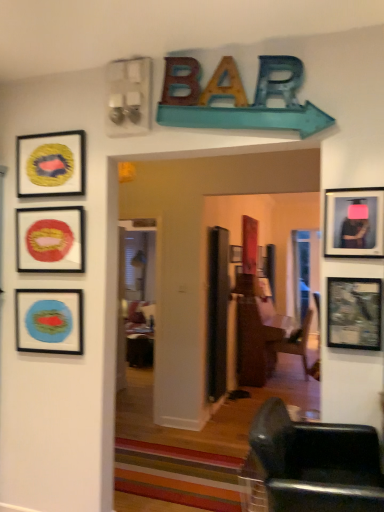
Question: Is wooden framed map at right, positioned as the fifth picture frame in left-to-right order, inside or outside of metallic silver television at right, which is counted as the 6th picture frame, starting from the back?

Choices:
 (A) inside
 (B) outside

Answer: (B)

Question: From their relative heights in the image, would you say wooden framed map at right, the 5th picture frame from the back, is taller or shorter than metallic silver television at right, which is counted as the 6th picture frame, starting from the back?

Choices:
 (A) short
 (B) tall

Answer: (A)

Question: Considering the real-world distances, which object is farthest from the matte red circular object at upper left, which is the 4th picture frame from back to front?

Choices:
 (A) wooden framed map at right, which ranks as the 2th picture frame in front-to-back order
 (B) matte black picture frame at center, which is counted as the first picture frame, starting from the back
 (C) black leather chair at lower right
 (D) brown wooden door at center
 (E) transparent glass door at center

Answer: (E)

Question: Estimate the real-world distances between objects in this image. Which object is farther from the matte black picture frame at center, which is the third picture frame from right to left?

Choices:
 (A) matte blue picture frame at left, positioned as the sixth picture frame in right-to-left order
 (B) wooden framed map at right, arranged as the second picture frame when viewed from the right
 (C) transparent glass door at center
 (D) metallic silver television at right, the 1th picture frame when ordered from right to left
 (E) yellow matte painting at upper left, the 5th picture frame from the front

Answer: (B)